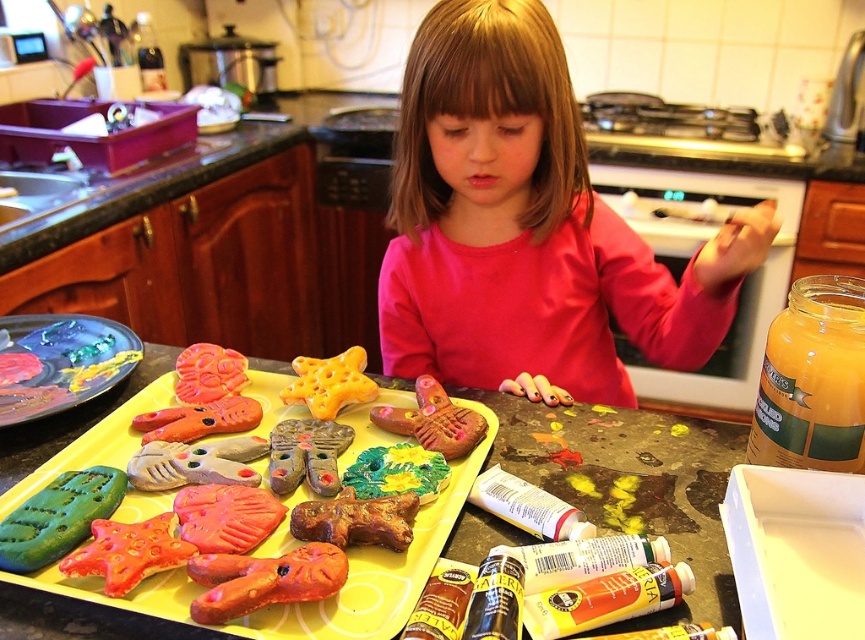
You are a chef preparing a dessert display. You have a painted ceramic plate at left and a yellow matte star at center. Which object should you choose if you need a larger item to hold a big cake?

The painted ceramic plate at left is larger in size than the yellow matte star at center, so you should choose the painted ceramic plate at left to hold the big cake.

You are a chef in a kitchen and need to place a new ingredient between the translucent glass jar at upper right and the yellow matte star at center. The ingredient is 10 inches long. Will there be enough space between them to fit the ingredient?

The translucent glass jar at upper right and the yellow matte star at center are 17.32 inches apart, so yes, the ingredient can fit between them since 10 inches is shorter than 17.32 inches.

You are a photographer taking a picture of the translucent glass jar at upper right. To ensure it is in the frame, where should you position your camera relative to the scene?

The translucent glass jar at upper right is located at point (812, 380), so position the camera so it faces the upper right area of the scene to capture the jar within the frame.